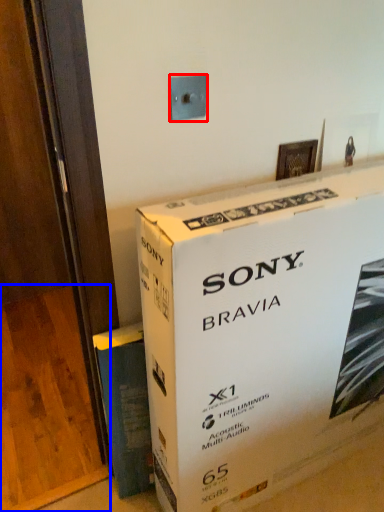
Question: Which object is further to the camera taking this photo, electric outlet (highlighted by a red box) or plywood (highlighted by a blue box)?

Choices:
 (A) electric outlet
 (B) plywood

Answer: (B)